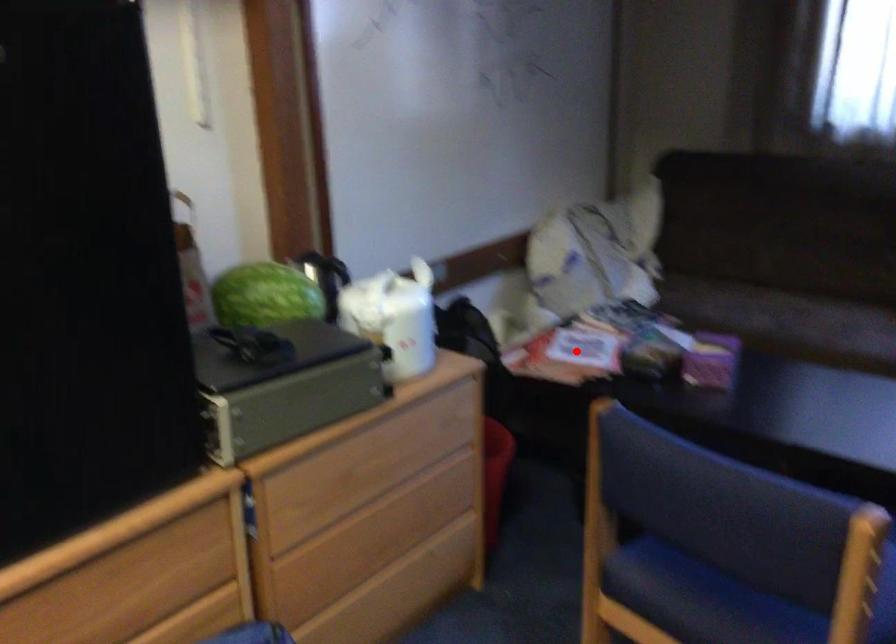
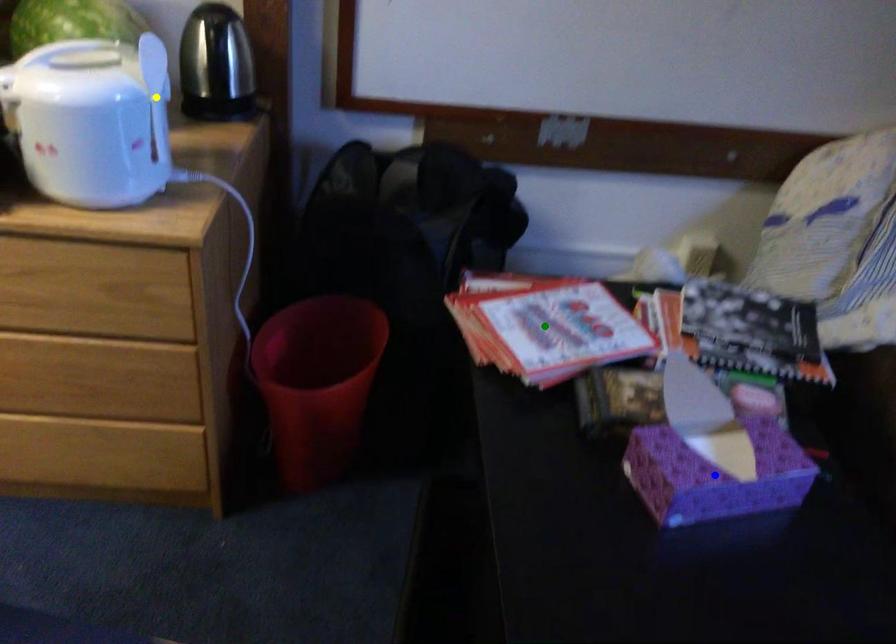
Question: I am providing you with two images of the same scene from different viewpoints. A red point is marked on the first image. You are given multiple points on the second image. Which spot in image 2 lines up with the point in image 1?

Choices:
 (A) yellow point
 (B) blue point
 (C) green point

Answer: (C)